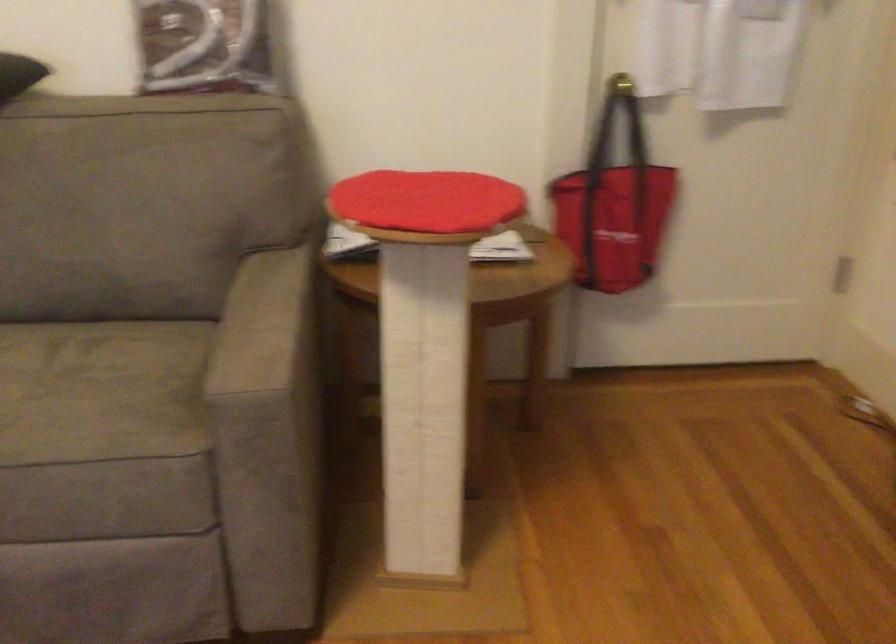
Where would you rest the grey sofa armrest? Please return your answer as a coordinate pair (x, y).

(263, 325)